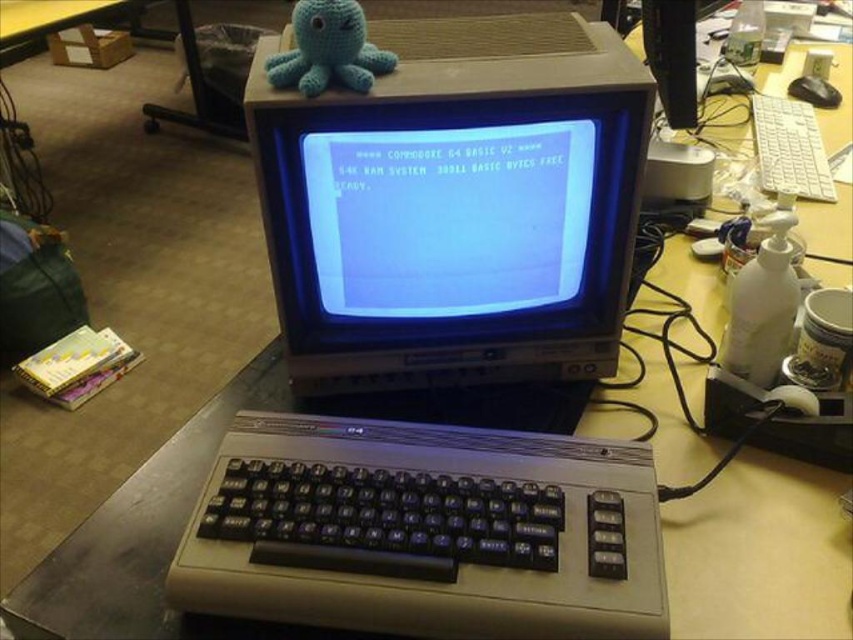
Question: Among these objects, which one is farthest from the camera?

Choices:
 (A) black plastic mouse at upper right
 (B) blue yarn octopus at upper center
 (C) white plastic keyboard at upper right
 (D) matte plastic monitor at center

Answer: (A)

Question: Is blue yarn octopus at upper center above white plastic keyboard at upper right?

Choices:
 (A) no
 (B) yes

Answer: (A)

Question: Which of the following is the farthest from the observer?

Choices:
 (A) (775, 189)
 (B) (332, 13)

Answer: (A)

Question: Which of the following is the closest to the observer?

Choices:
 (A) blue yarn octopus at upper center
 (B) black plastic mouse at upper right
 (C) white plastic keyboard at upper right
 (D) matte plastic monitor at center

Answer: (A)

Question: Can you confirm if matte plastic monitor at center is smaller than black plastic mouse at upper right?

Choices:
 (A) no
 (B) yes

Answer: (A)

Question: In this image, where is matte plastic monitor at center located relative to blue yarn octopus at upper center?

Choices:
 (A) below
 (B) above

Answer: (A)